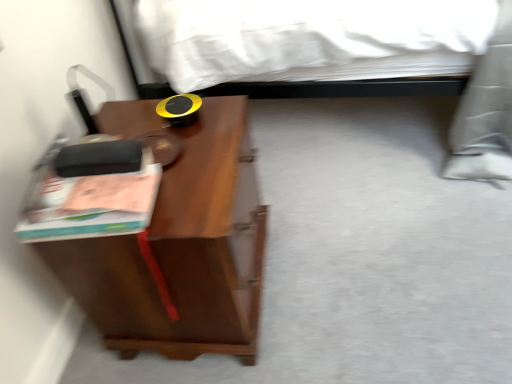
Question: Is brown wood nightstand at left taller or shorter than matte pink paperback book at left?

Choices:
 (A) short
 (B) tall

Answer: (B)

Question: From a real-world perspective, relative to matte pink paperback book at left, is brown wood nightstand at left vertically above or below?

Choices:
 (A) above
 (B) below

Answer: (B)

Question: Which is correct: brown wood nightstand at left is inside matte pink paperback book at left, or outside of it?

Choices:
 (A) inside
 (B) outside

Answer: (B)

Question: From their relative heights in the image, would you say matte pink paperback book at left is taller or shorter than brown wood nightstand at left?

Choices:
 (A) short
 (B) tall

Answer: (A)

Question: From a real-world perspective, relative to brown wood nightstand at left, is matte pink paperback book at left vertically above or below?

Choices:
 (A) above
 (B) below

Answer: (A)

Question: From the image's perspective, is matte pink paperback book at left positioned above or below brown wood nightstand at left?

Choices:
 (A) above
 (B) below

Answer: (A)

Question: Considering the positions of matte pink paperback book at left and brown wood nightstand at left in the image, is matte pink paperback book at left wider or thinner than brown wood nightstand at left?

Choices:
 (A) wide
 (B) thin

Answer: (B)